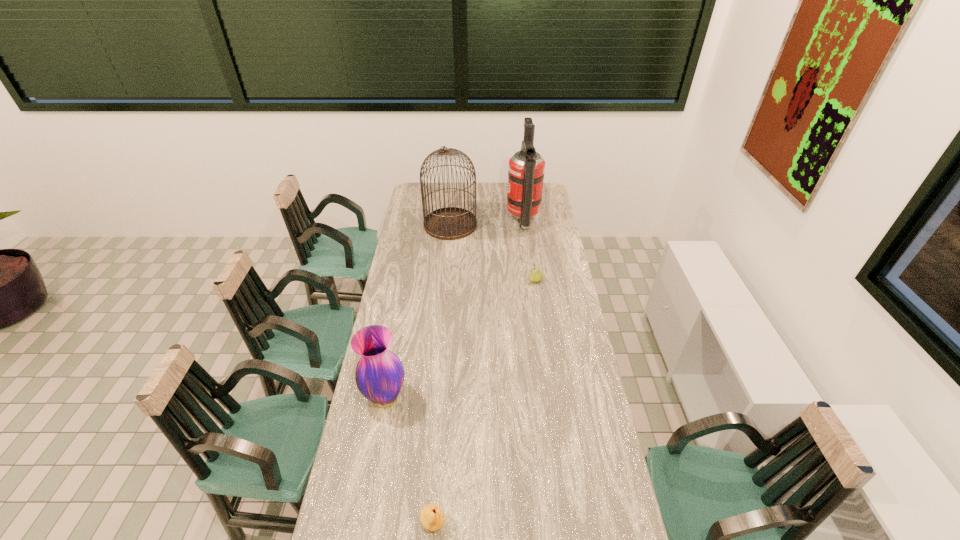
The width and height of the screenshot is (960, 540). I want to click on vacant space situated on the front label side of the fire extinguisher, so click(483, 221).

Image resolution: width=960 pixels, height=540 pixels. I want to click on free space located on the front of the fourth shortest object, so 448,247.

Identify the location of free location located on the right of the second nearest object. The height and width of the screenshot is (540, 960). (504, 398).

Locate an element on the screen. The image size is (960, 540). free location located on the back of the right pear is located at coordinates 531,249.

Where is `vacant space located on the back of the left pear`? This screenshot has width=960, height=540. vacant space located on the back of the left pear is located at coordinates (443, 394).

Where is `birdcage present at the left edge`? The height and width of the screenshot is (540, 960). birdcage present at the left edge is located at coordinates (449, 223).

Locate an element on the screen. This screenshot has height=540, width=960. vase that is positioned at the left edge is located at coordinates (379, 375).

At what (x,y) coordinates should I click in order to perform the action: click on fire extinguisher located in the right edge section of the desktop. Please return your answer as a coordinate pair (x, y). Looking at the image, I should click on (526, 169).

Identify the location of pear that is at the right edge. (535, 275).

Locate an element on the screen. vacant space at the far edge is located at coordinates (491, 192).